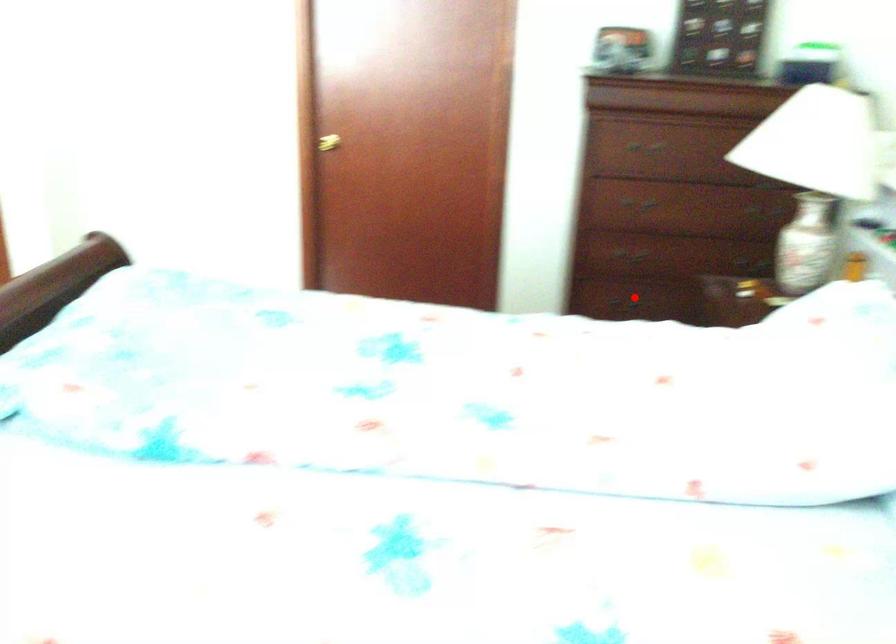
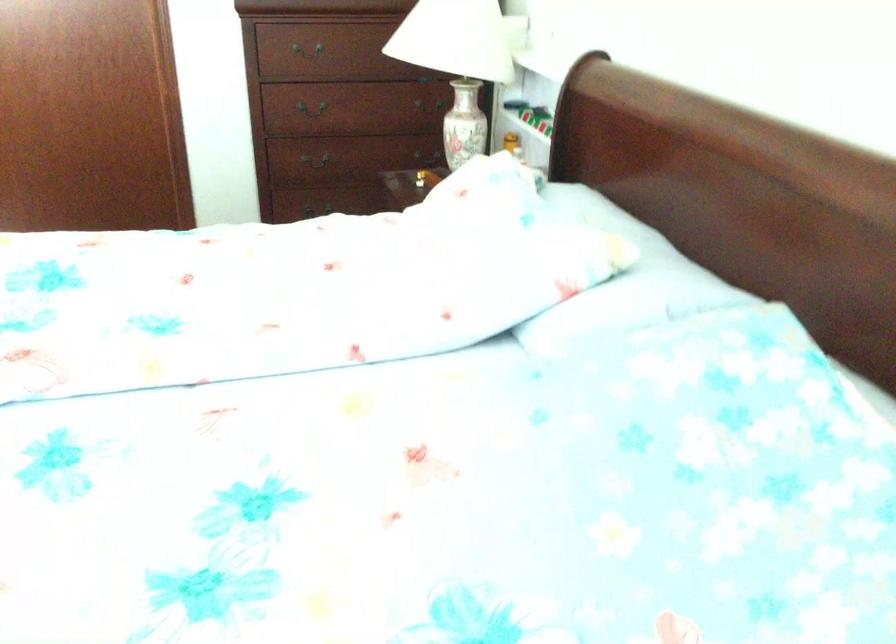
The point at the highlighted location is marked in the first image. Where is the corresponding point in the second image?

(321, 200)